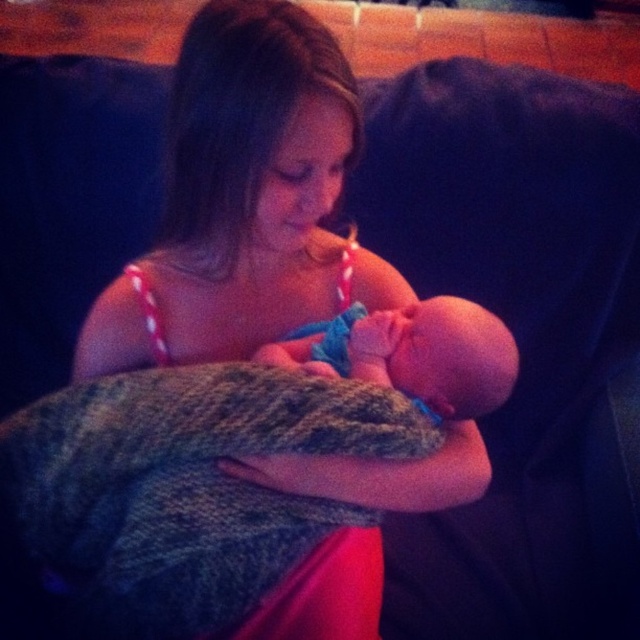
In the scene shown: Does matte pink dress at center have a lesser height compared to smooth skin newborn at center?

No.

Measure the distance from matte pink dress at center to smooth skin newborn at center.

matte pink dress at center is 4.03 inches from smooth skin newborn at center.

Which is in front, point (172, 352) or point (490, 385)?

Point (490, 385) is more forward.

Locate an element on the screen. matte pink dress at center is located at coordinates (276, 248).